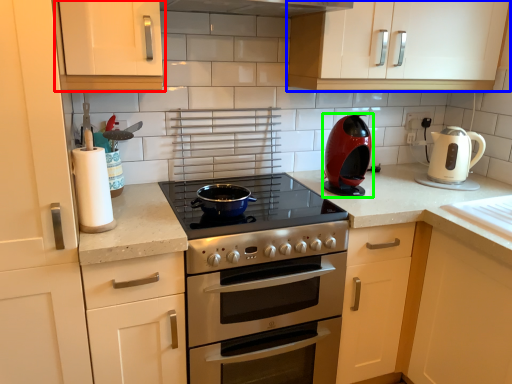
Question: Estimate the real-world distances between objects in this image. Which object is farther from cabinetry (highlighted by a red box), cabinetry (highlighted by a blue box) or kitchen appliance (highlighted by a green box)?

Choices:
 (A) cabinetry
 (B) kitchen appliance

Answer: (A)